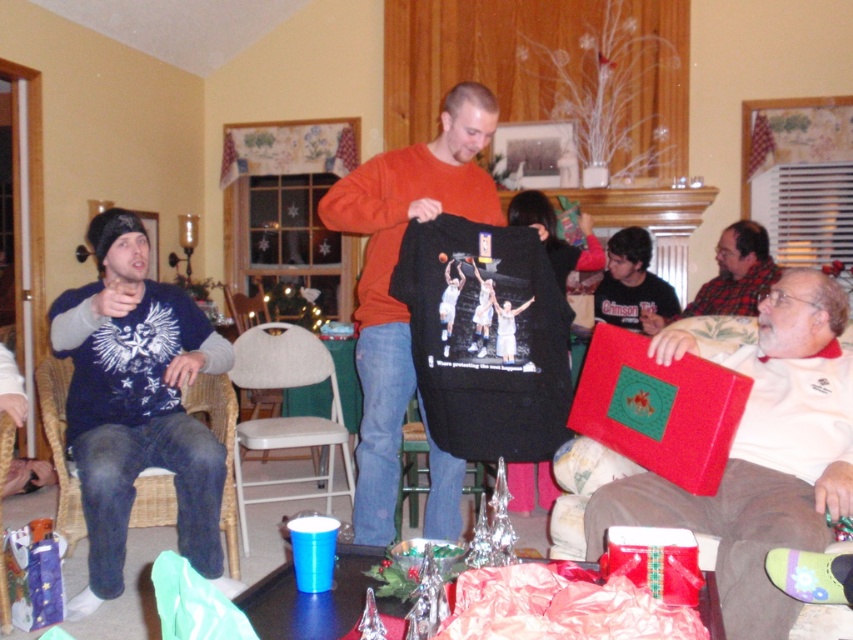
Does point (144, 348) come closer to viewer compared to point (287, 481)?

Yes, it is.

Image resolution: width=853 pixels, height=640 pixels. Find the location of `blue cotton shirt at left`. blue cotton shirt at left is located at coordinates (137, 404).

Does point (134, 349) come behind point (352, 486)?

No, it is not.

Locate an element on the screen. Image resolution: width=853 pixels, height=640 pixels. blue cotton shirt at left is located at coordinates (137, 404).

Who is positioned more to the left, blue cotton shirt at left or wooden woven armchair at lower left?

Positioned to the left is wooden woven armchair at lower left.

Can you confirm if blue cotton shirt at left is shorter than wooden woven armchair at lower left?

Incorrect, blue cotton shirt at left's height does not fall short of wooden woven armchair at lower left's.

Who is more distant from viewer, (88, 531) or (0, 513)?

Point (0, 513)

Locate an element on the screen. Image resolution: width=853 pixels, height=640 pixels. blue cotton shirt at left is located at coordinates (137, 404).

Between red matte gift bag at lower right and blue fabric wrapped gift at lower left, which one appears on the right side from the viewer's perspective?

Positioned to the right is red matte gift bag at lower right.

Between point (643, 573) and point (19, 564), which one is positioned in front?

Point (643, 573) is more forward.

Who is more distant from viewer, (601, 564) or (9, 534)?

Positioned behind is point (9, 534).

The image size is (853, 640). Identify the location of red matte gift bag at lower right. (654, 561).